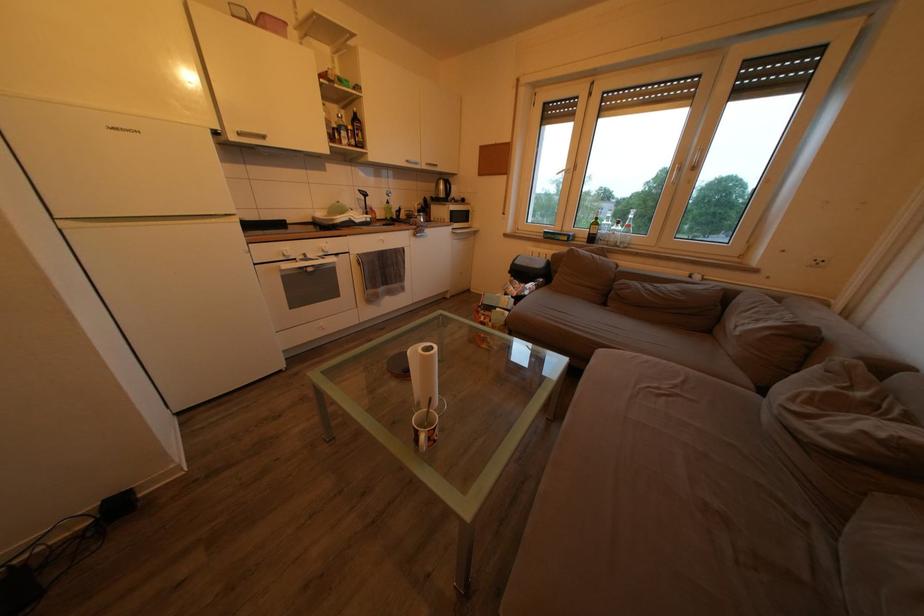
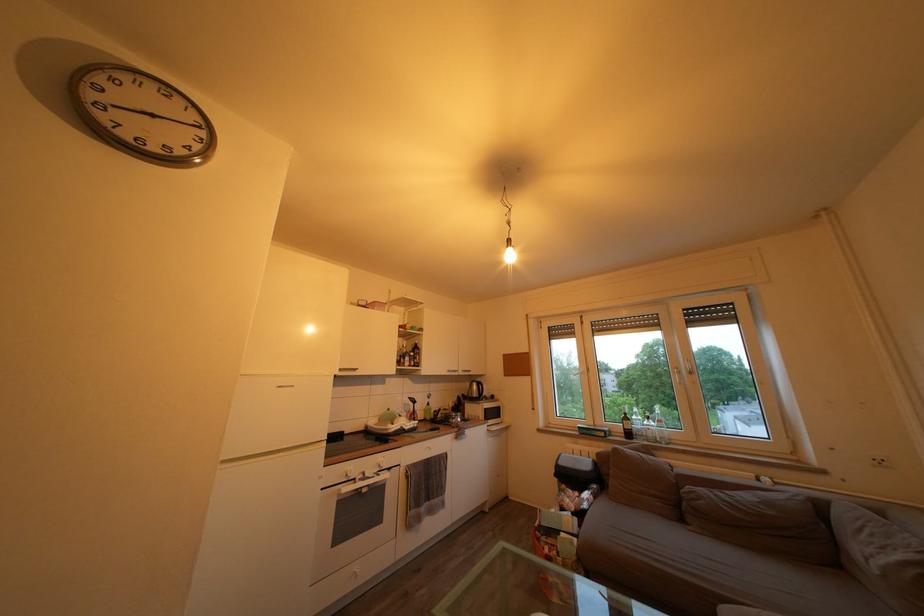
Locate, in the second image, the point that corresponds to (450,192) in the first image.

(482, 392)